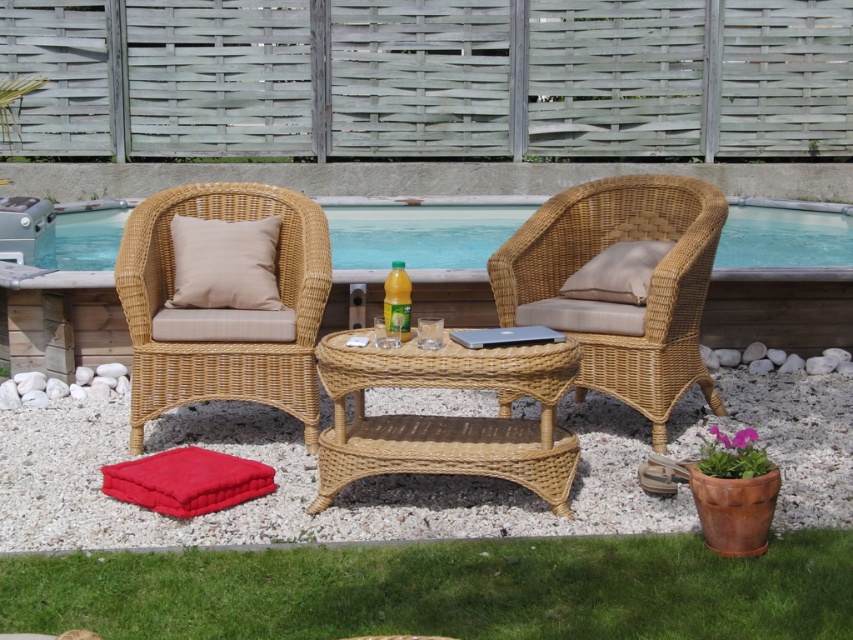
You are planning to place a new potted plant on the natural wicker table at center. However, you notice the transparent blue water at center is in the way. Can you place the plant on the table without disturbing the water?

The natural wicker table at center is below the transparent blue water at center, so placing the plant on the table would require moving the water first to avoid obstruction.

You are planning to place a large potted plant between the natural wicker armchair at center and the natural wicker armchair at left. Considering their widths, which chair should the plant be closer to?

The natural wicker armchair at center is wider than the natural wicker armchair at left, so the large potted plant should be placed closer to the natural wicker armchair at left to maintain balance between the two chairs.

You are standing at the origin point in the garden. The natural wicker armchair at left is at coordinates 0.537, 0.261. If you want to walk directly to it, in which direction should you head?

The natural wicker armchair at left is located at point (222,342), so you should head northeast to reach it.